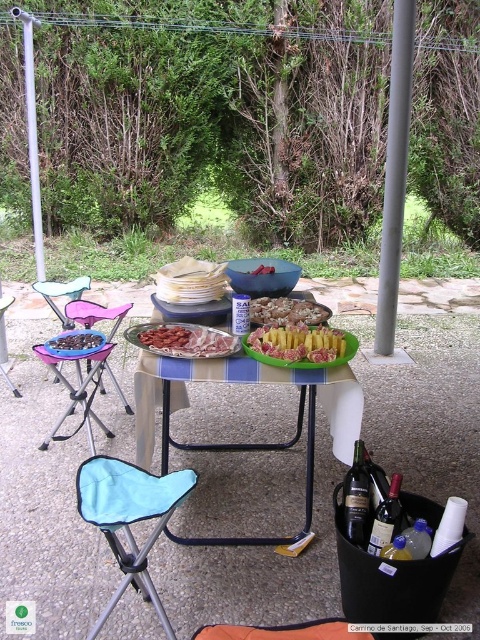
Who is lower down, plastic/metallic table at center or smooth red meat at center?

plastic/metallic table at center

Based on the photo, between plastic/metallic table at center and smooth red meat at center, which one has less height?

Standing shorter between the two is smooth red meat at center.

Where is `plastic/metallic table at center`? plastic/metallic table at center is located at coordinates (243, 442).

Does yellow rubbery pineapple at center come behind smooth chocolate bar at center?

That is False.

Between yellow rubbery pineapple at center and smooth chocolate bar at center, which one appears on the right side from the viewer's perspective?

From the viewer's perspective, yellow rubbery pineapple at center appears more on the right side.

Does point (331, 336) come behind point (72, 353)?

That is False.

You are a GUI agent. You are given a task and a screenshot of the screen. Output one action in this format:
    pyautogui.click(x=<x>, y=<y>)
    Task: Click on the yellow rubbery pineapple at center
    This screenshot has height=640, width=480.
    Given the screenshot: What is the action you would take?
    pyautogui.click(x=300, y=342)

Which is behind, point (259, 445) or point (192, 339)?

The point (259, 445) is behind.

Is point (268, 378) closer to viewer compared to point (153, 328)?

Yes, point (268, 378) is in front of point (153, 328).

Describe the element at coordinates (243, 442) in the screenshot. I see `plastic/metallic table at center` at that location.

Find the location of a particular element. This screenshot has height=640, width=480. plastic/metallic table at center is located at coordinates (243, 442).